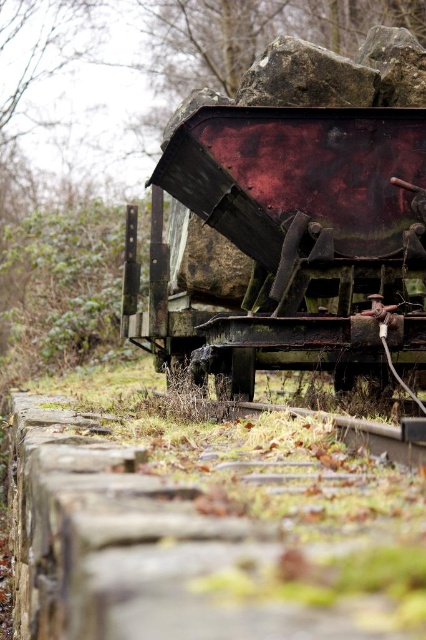
Is rusty metal train car at center shorter than rusty metal rock at upper center?

In fact, rusty metal train car at center may be taller than rusty metal rock at upper center.

Is point (210, 161) in front of point (313, 48)?

Yes, it is.

Describe the element at coordinates (294, 230) in the screenshot. I see `rusty metal train car at center` at that location.

Locate an element on the screen. This screenshot has width=426, height=640. rusty metal train car at center is located at coordinates (294, 230).